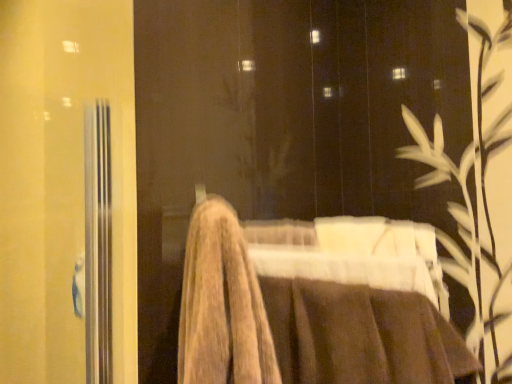
Locate an element on the screen. Image resolution: width=512 pixels, height=384 pixels. brown textured fabric bed at center is located at coordinates (303, 312).

What do you see at coordinates (303, 312) in the screenshot?
I see `brown textured fabric bed at center` at bounding box center [303, 312].

Identify the location of brown textured fabric bed at center. This screenshot has width=512, height=384. (303, 312).